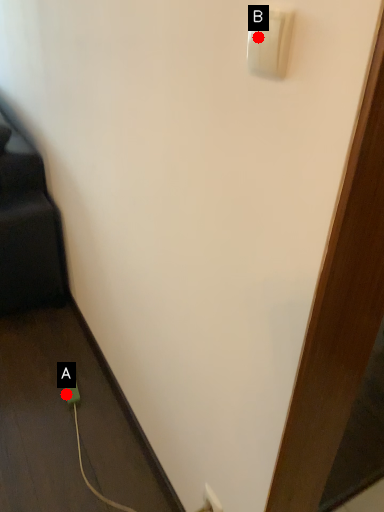
Question: Two points are circled on the image, labeled by A and B beside each circle. Among these points, which one is nearest to the camera?

Choices:
 (A) A is closer
 (B) B is closer

Answer: (B)